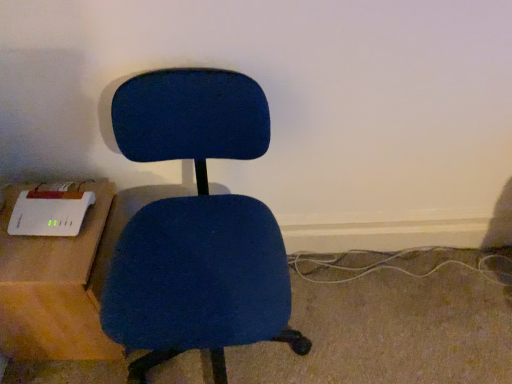
This screenshot has height=384, width=512. I want to click on matte blue office chair at center, so click(x=196, y=227).

Describe the element at coordinates (196, 227) in the screenshot. I see `matte blue office chair at center` at that location.

The height and width of the screenshot is (384, 512). Find the location of `white plastic router at left`. white plastic router at left is located at coordinates 53,286.

Image resolution: width=512 pixels, height=384 pixels. What do you see at coordinates (53, 286) in the screenshot?
I see `white plastic router at left` at bounding box center [53, 286].

You are a GUI agent. You are given a task and a screenshot of the screen. Output one action in this format:
    pyautogui.click(x=<x>, y=<y>)
    Task: Click on the matte blue office chair at center
    This screenshot has width=512, height=384.
    Given the screenshot: What is the action you would take?
    pyautogui.click(x=196, y=227)

Which object is positioned more to the right, matte blue office chair at center or white plastic router at left?

matte blue office chair at center.

Is matte blue office chair at center positioned in front of white plastic router at left?

Yes, matte blue office chair at center is in front of white plastic router at left.

Considering the positions of points (218, 310) and (6, 335), is point (218, 310) closer to camera compared to point (6, 335)?

Yes, it is in front of point (6, 335).

Consider the image. From the image's perspective, is matte blue office chair at center located above or below white plastic router at left?

Based on their image positions, matte blue office chair at center is located above white plastic router at left.

From a real-world perspective, between matte blue office chair at center and white plastic router at left, who is vertically lower?

white plastic router at left, from a real-world perspective.

Considering the relative sizes of matte blue office chair at center and white plastic router at left in the image provided, is matte blue office chair at center wider than white plastic router at left?

Correct, the width of matte blue office chair at center exceeds that of white plastic router at left.

Who is taller, matte blue office chair at center or white plastic router at left?

With more height is matte blue office chair at center.

Considering the relative sizes of matte blue office chair at center and white plastic router at left in the image provided, is matte blue office chair at center bigger than white plastic router at left?

Correct, matte blue office chair at center is larger in size than white plastic router at left.

Is matte blue office chair at center positioned beyond the bounds of white plastic router at left?

That's correct, matte blue office chair at center is outside of white plastic router at left.

Is matte blue office chair at center far from white plastic router at left?

No, matte blue office chair at center is not far away from white plastic router at left.

Could you tell me if matte blue office chair at center is turned towards white plastic router at left?

No.

How many degrees apart are the facing directions of matte blue office chair at center and white plastic router at left?

87 degrees.

This screenshot has height=384, width=512. What are the coordinates of `table below the matte blue office chair at center (from a real-world perspective)` in the screenshot? It's located at pos(53,286).

Is white plastic router at left to the left or to the right of matte blue office chair at center in the image?

white plastic router at left is to the left of matte blue office chair at center.

Between white plastic router at left and matte blue office chair at center, which one is positioned in front?

matte blue office chair at center is more forward.

Which point is more forward, (57, 330) or (222, 85)?

The point (222, 85) is more forward.

From the image's perspective, between white plastic router at left and matte blue office chair at center, which one is located above?

matte blue office chair at center.

From a real-world perspective, is white plastic router at left below matte blue office chair at center?

Correct, in the physical world, white plastic router at left is lower than matte blue office chair at center.

Is white plastic router at left wider than matte blue office chair at center?

No.

Considering the relative sizes of white plastic router at left and matte blue office chair at center in the image provided, is white plastic router at left taller than matte blue office chair at center?

Incorrect, the height of white plastic router at left is not larger of that of matte blue office chair at center.

Is white plastic router at left bigger than matte blue office chair at center?

Incorrect, white plastic router at left is not larger than matte blue office chair at center.

Is white plastic router at left inside or outside of matte blue office chair at center?

white plastic router at left is spatially situated outside matte blue office chair at center.

Is white plastic router at left beside matte blue office chair at center?

They are not placed beside each other.

Is white plastic router at left turned away from matte blue office chair at center?

No, white plastic router at left is not facing the opposite direction of matte blue office chair at center.

How different are the orientations of white plastic router at left and matte blue office chair at center in degrees?

87 degrees separate the facing orientations of white plastic router at left and matte blue office chair at center.

Where is `chair above the white plastic router at left (from a real-world perspective)`? The width and height of the screenshot is (512, 384). chair above the white plastic router at left (from a real-world perspective) is located at coordinates (196, 227).

You are a GUI agent. You are given a task and a screenshot of the screen. Output one action in this format:
    pyautogui.click(x=<x>, y=<y>)
    Task: Click on the chair to the right of white plastic router at left
    
    Given the screenshot: What is the action you would take?
    pyautogui.click(x=196, y=227)

The width and height of the screenshot is (512, 384). Identify the location of table behind the matte blue office chair at center. (53, 286).